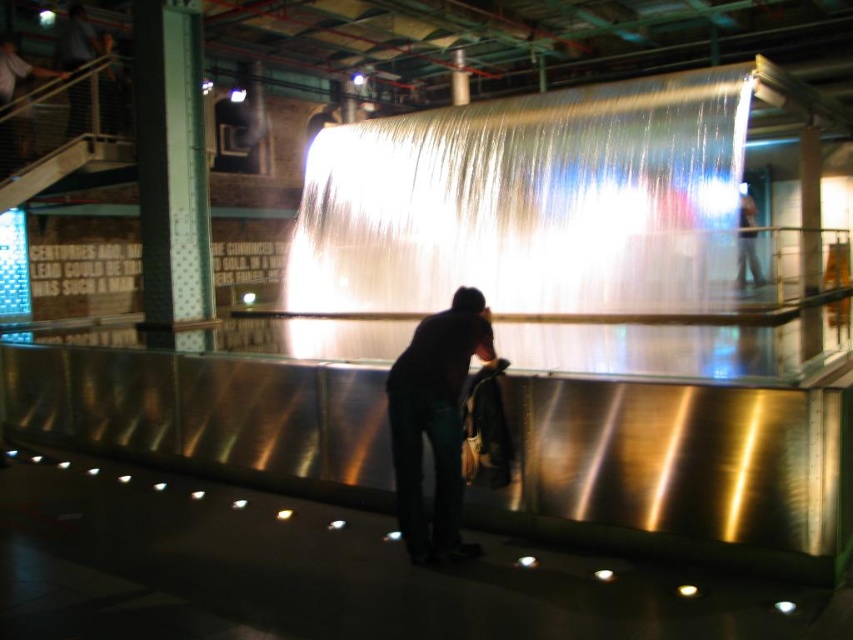
Does translucent glass waterfall at center have a greater height compared to dark blue jeans at upper right?

Indeed, translucent glass waterfall at center has a greater height compared to dark blue jeans at upper right.

This screenshot has width=853, height=640. Identify the location of translucent glass waterfall at center. (531, 202).

You are a GUI agent. You are given a task and a screenshot of the screen. Output one action in this format:
    pyautogui.click(x=<x>, y=<y>)
    Task: Click on the translucent glass waterfall at center
    
    Given the screenshot: What is the action you would take?
    pyautogui.click(x=531, y=202)

Between dark fabric bag at center and dark blue jeans at upper right, which one appears on the right side from the viewer's perspective?

Positioned to the right is dark blue jeans at upper right.

Which is behind, point (451, 506) or point (746, 243)?

Point (746, 243)

You are a GUI agent. You are given a task and a screenshot of the screen. Output one action in this format:
    pyautogui.click(x=<x>, y=<y>)
    Task: Click on the dark fabric bag at center
    This screenshot has width=853, height=640.
    Given the screenshot: What is the action you would take?
    pyautogui.click(x=434, y=422)

Does point (575, 109) lie in front of point (418, 509)?

No.

Measure the distance between point (339, 211) and camera.

The distance of point (339, 211) from camera is 43.98 feet.

Where is `translucent glass waterfall at center`? The width and height of the screenshot is (853, 640). translucent glass waterfall at center is located at coordinates (531, 202).